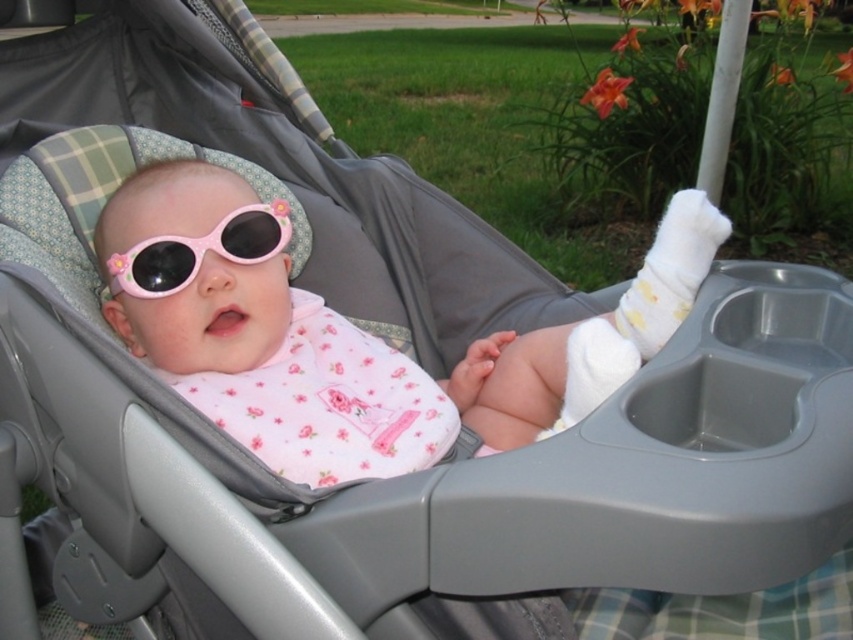
Question: Does pink glossy sunglasses at center appear over pink plastic goggles at center?

Choices:
 (A) no
 (B) yes

Answer: (A)

Question: Can you confirm if pink glossy sunglasses at center is positioned to the left of pink plastic goggles at center?

Choices:
 (A) no
 (B) yes

Answer: (A)

Question: Can you confirm if pink glossy sunglasses at center is thinner than pink plastic goggles at center?

Choices:
 (A) yes
 (B) no

Answer: (B)